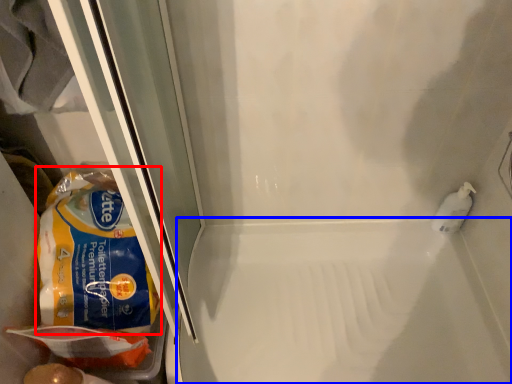
Question: Which object is further to the camera taking this photo, cereal (highlighted by a red box) or bath (highlighted by a blue box)?

Choices:
 (A) cereal
 (B) bath

Answer: (B)